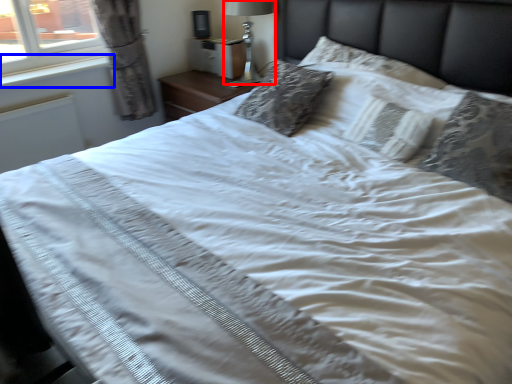
Question: Which object appears closest to the camera in this image, bedside lamp (highlighted by a red box) or window sill (highlighted by a blue box)?

Choices:
 (A) bedside lamp
 (B) window sill

Answer: (B)